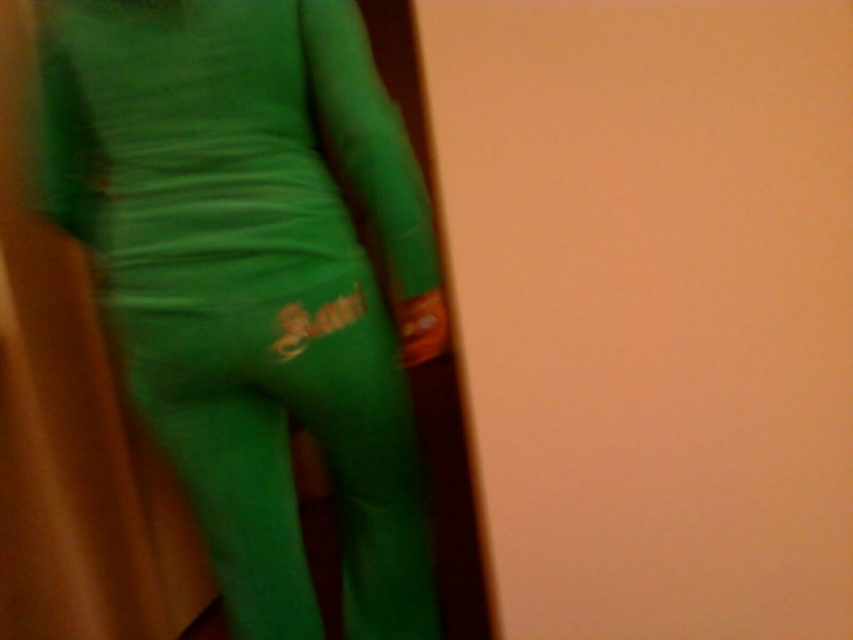
Is green matte leggings at center thinner than matte green pants at center?

No, green matte leggings at center is not thinner than matte green pants at center.

How far apart are green matte leggings at center and matte green pants at center?

The distance of green matte leggings at center from matte green pants at center is 2.27 inches.

This screenshot has width=853, height=640. I want to click on green matte leggings at center, so click(x=254, y=278).